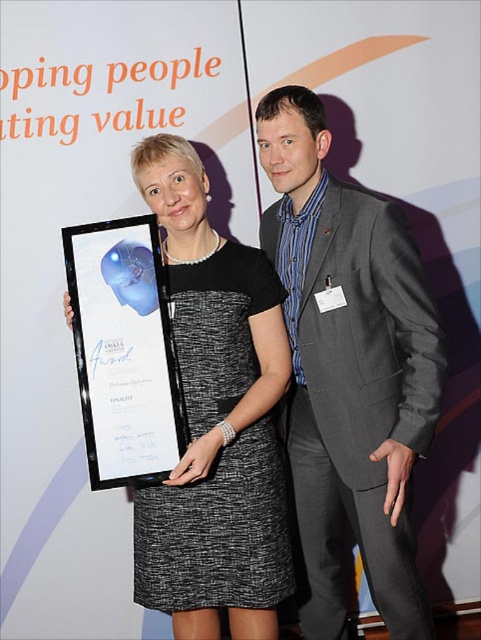
You are attending an awards ceremony and see the black textured dress at center and the white glossy plaque at center. Which object is positioned lower in the image?

The black textured dress at center is positioned below the white glossy plaque at center, so it is lower in the image.

You are a photographer setting up for a group photo. You notice the black textured dress at center and the white glossy plaque at center in the scene. Which object should you focus on first to ensure both are in sharp focus?

You should focus on the black textured dress at center first because it is closer to the viewer than the white glossy plaque at center, ensuring the plaque will also be in focus if the dress is sharp.

You are standing at a distance of 5 feet from the point marked at coordinates point (215, 364). Can you comfortably reach it without moving closer?

The point (215, 364) is 5.61 feet away from the viewer, so you cannot comfortably reach it without moving closer because it is slightly farther than your current distance of 5 feet.